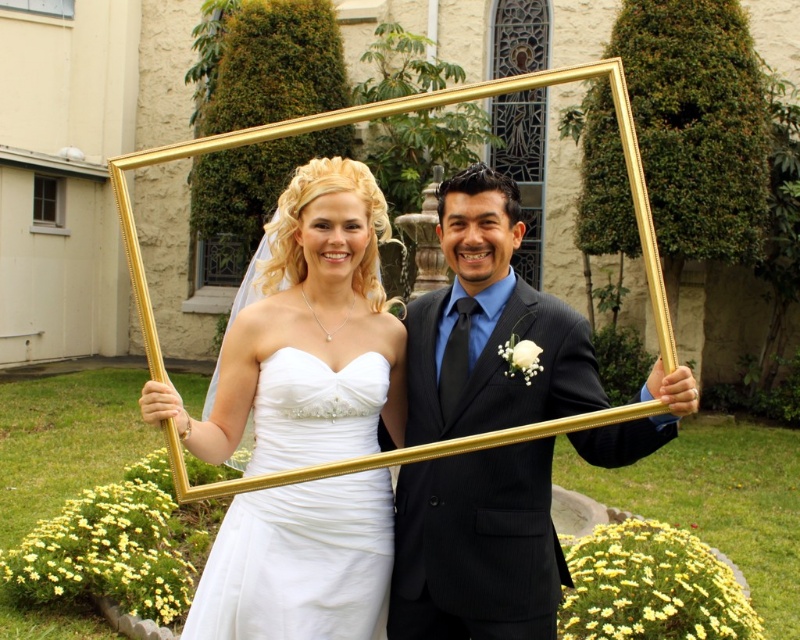
You are standing in the garden where the bride and groom are posing. You notice two points marked on the ground at coordinates point (322, 289) and point (293, 413). If you want to place a flower bouquet closer to the foreground, which point should you choose?

Point (322, 289) is further to the viewer than point (293, 413), so you should choose point (322, 289) to place the flower bouquet closer to the foreground.

You are a photographer who needs to ensure the visibility of both the matte white dress at center and the white satin wedding dress at center in a photo. Which dress should you focus on first to ensure proper exposure, considering their positions?

The matte white dress at center is located above the white satin wedding dress at center, so focusing on the matte white dress at center first will help ensure proper exposure for both dresses.